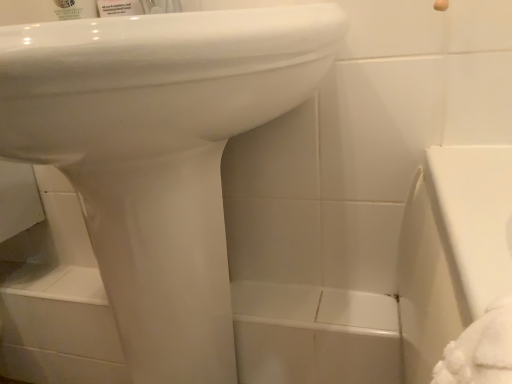
Describe the element at coordinates (159, 154) in the screenshot. The height and width of the screenshot is (384, 512). I see `white glossy sink at center` at that location.

What is the approximate width of white glossy sink at center?

20.96 inches.

You are a GUI agent. You are given a task and a screenshot of the screen. Output one action in this format:
    pyautogui.click(x=<x>, y=<y>)
    Task: Click on the white glossy sink at center
    This screenshot has height=384, width=512.
    Given the screenshot: What is the action you would take?
    pyautogui.click(x=159, y=154)

The width and height of the screenshot is (512, 384). I want to click on white glossy sink at center, so click(x=159, y=154).